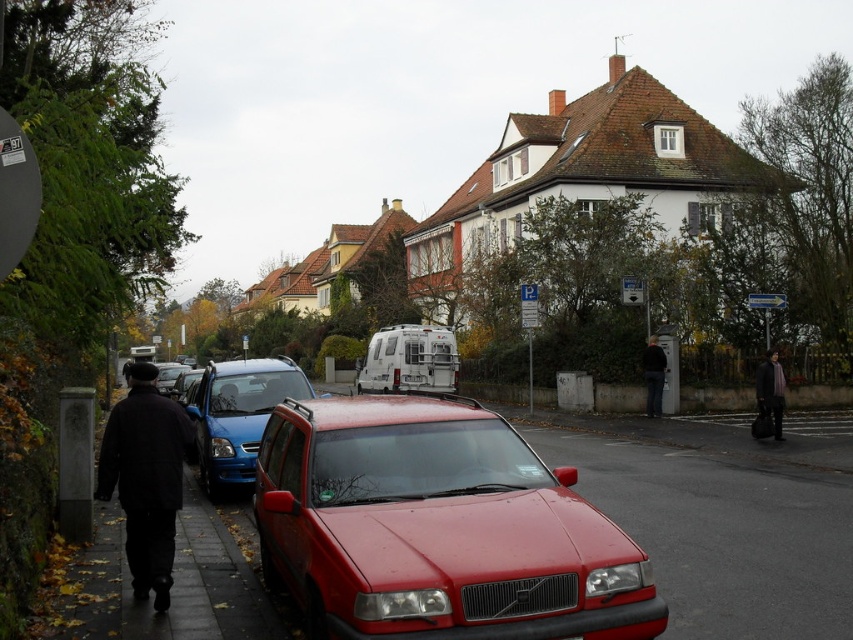
Does point (190, 435) come behind point (235, 376)?

No.

Does black woolen coat at left have a greater height compared to metallic red suv at center?

No.

Which is behind, point (149, 436) or point (219, 410)?

The point (219, 410) is more distant.

Image resolution: width=853 pixels, height=640 pixels. Find the location of `black woolen coat at left`. black woolen coat at left is located at coordinates click(146, 477).

Is point (271, 384) behind point (759, 417)?

No.

Is point (241, 371) positioned after point (759, 396)?

No.

The height and width of the screenshot is (640, 853). In order to click on metallic red suv at center in this screenshot , I will do `click(238, 413)`.

Is metallic blue car at center shorter than white plastic van at center?

No.

Which of these two, metallic blue car at center or white plastic van at center, stands shorter?

white plastic van at center

Find the location of a particular element. The height and width of the screenshot is (640, 853). metallic blue car at center is located at coordinates (169, 376).

You are a GUI agent. You are given a task and a screenshot of the screen. Output one action in this format:
    pyautogui.click(x=<x>, y=<y>)
    Task: Click on the metallic blue car at center
    This screenshot has width=853, height=640.
    Given the screenshot: What is the action you would take?
    pyautogui.click(x=169, y=376)